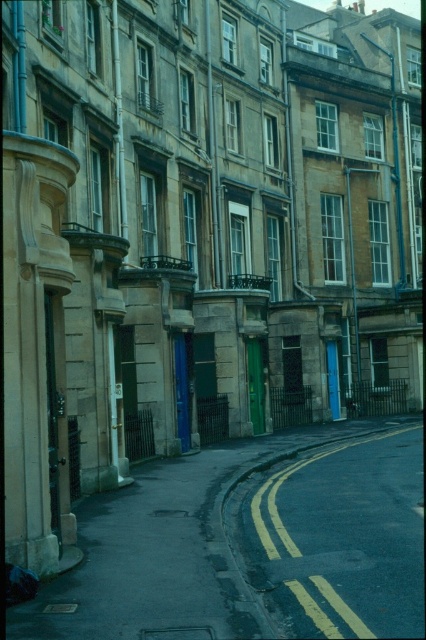
Who is positioned more to the right, smooth asphalt road at center or yellow asphalt at center?

From the viewer's perspective, yellow asphalt at center appears more on the right side.

What are the coordinates of `smooth asphalt road at center` in the screenshot? It's located at (252, 545).

The image size is (426, 640). Find the location of `smooth asphalt road at center`. smooth asphalt road at center is located at coordinates (252, 545).